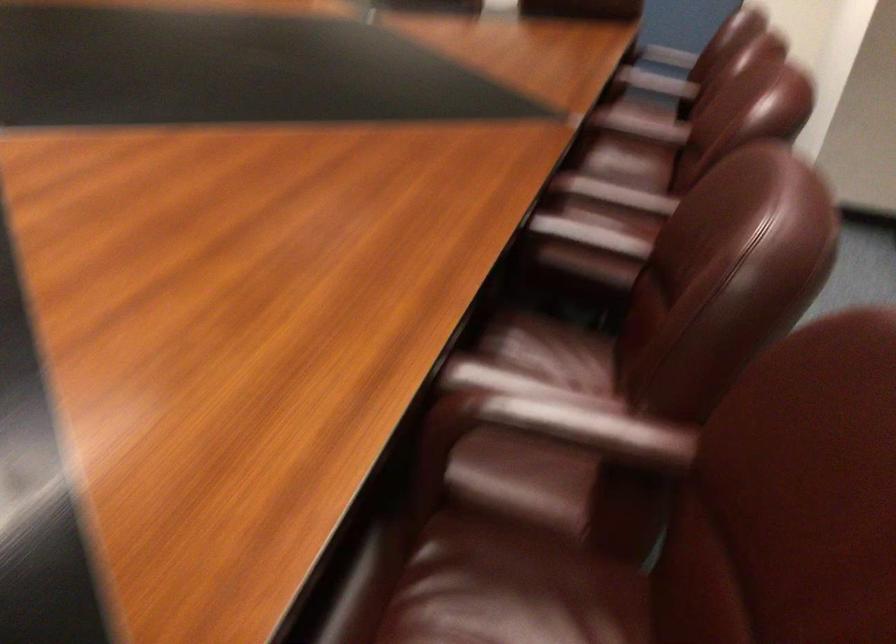
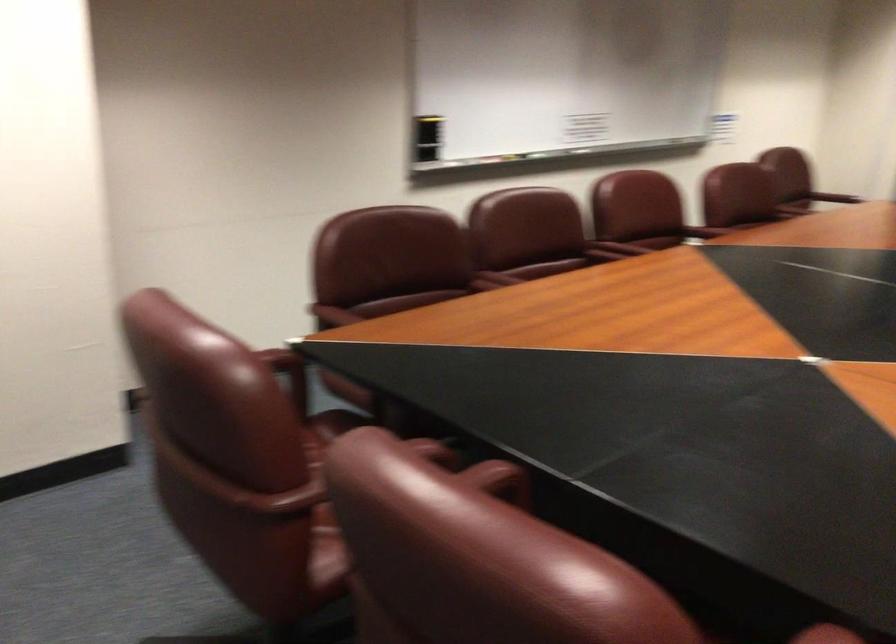
Where in the second image is the point corresponding to point 410,506 from the first image?

(834, 198)